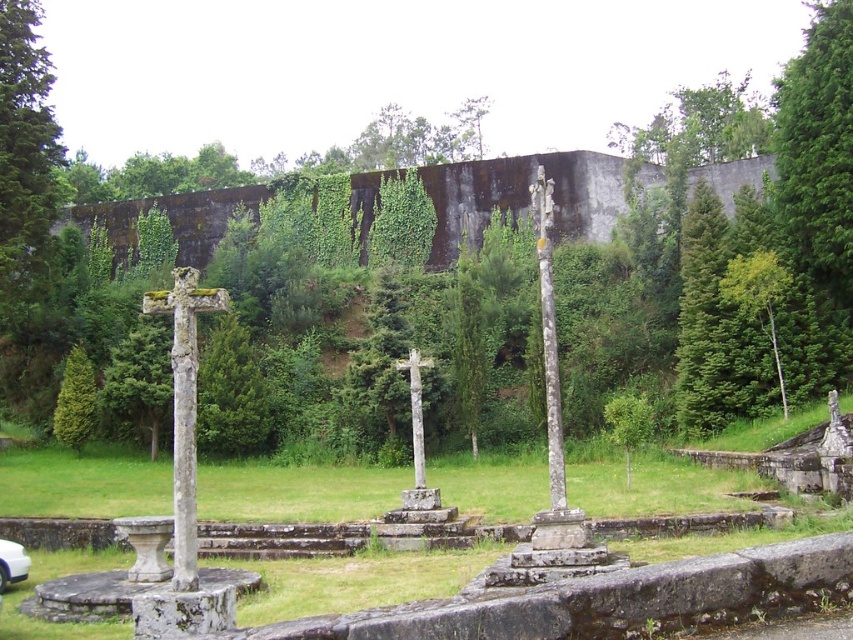
You are standing at the entrance of the memorial area and want to take a photo of both the green textured stone cross at lower left and the white stone cross at center. Can you see both crosses in your camera frame at the same time?

The white stone cross at center is behind the green textured stone cross at lower left, so you cannot see both crosses in the same camera frame because the green textured stone cross at lower left is blocking the view of the white stone cross at center.

You are a photographer trying to capture the stone cross at left without any obstructions. You notice the white glossy car at lower left. Based on their positions, can you position yourself so that the car does not block your view of the cross?

The stone cross at left is in front of the white glossy car at lower left, so if you position yourself behind the car, you can still see the cross in front of it without obstruction.